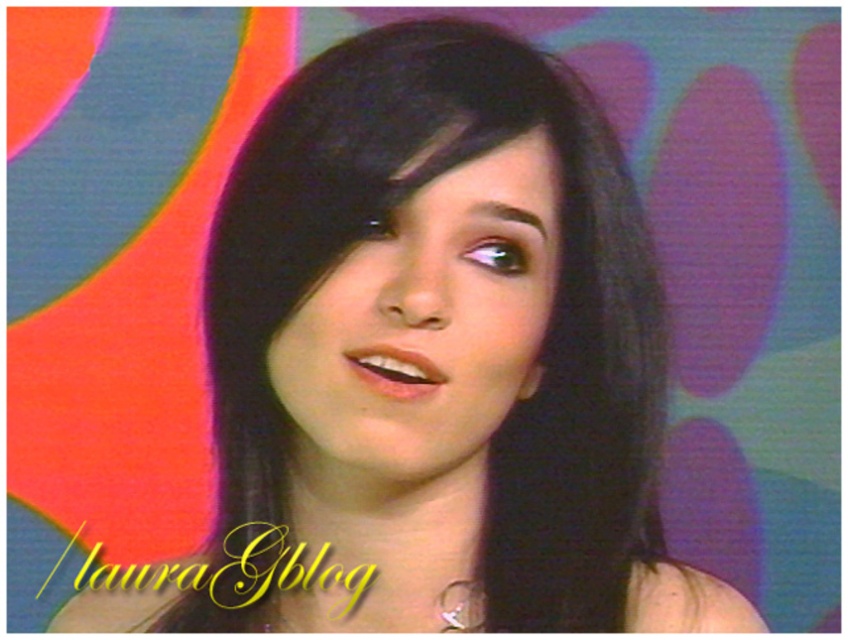
Is smooth skin face at center above silver metallic earring at lower center?

Indeed, smooth skin face at center is positioned over silver metallic earring at lower center.

Can you confirm if smooth skin face at center is wider than silver metallic earring at lower center?

Indeed, smooth skin face at center has a greater width compared to silver metallic earring at lower center.

Find the location of `smooth skin face at center`. smooth skin face at center is located at coordinates (424, 324).

Find the location of a particular element. The height and width of the screenshot is (640, 848). smooth skin face at center is located at coordinates (424, 324).